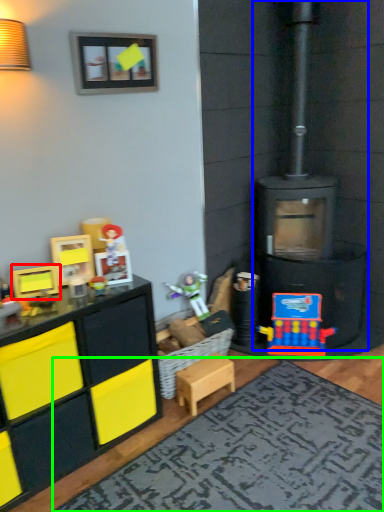
Question: Considering the real-world distances, which object is farthest from toy (highlighted by a red box)? fireplace (highlighted by a blue box) or mat (highlighted by a green box)?

Choices:
 (A) fireplace
 (B) mat

Answer: (A)